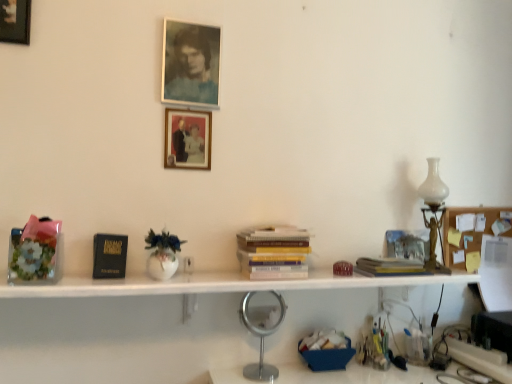
Identify the location of hardcover books at center, the first book in the left-to-right sequence. This screenshot has width=512, height=384. (274, 252).

The width and height of the screenshot is (512, 384). I want to click on white glass table lamp at right, positioned as the 2th table lamp in left-to-right order, so click(434, 212).

Find the location of a particular element. This screenshot has width=512, height=384. hardcover book at center, the first book from the right is located at coordinates (390, 267).

Describe the element at coordinates (390, 267) in the screenshot. I see `hardcover book at center, the first book from the right` at that location.

Describe the element at coordinates (470, 231) in the screenshot. I see `wooden memo board at right` at that location.

Locate an element on the screen. Image resolution: width=512 pixels, height=384 pixels. matte glass photo frame at upper center, which is the 2th picture frame in top-to-bottom order is located at coordinates (190, 63).

Does matte glass photo frame at upper center, which is the 2th picture frame in top-to-bottom order, have a greater height compared to white matte bookshelf at center?

Yes.

Is matte glass photo frame at upper center, arranged as the 1th picture frame when viewed from the right, positioned with its back to white matte bookshelf at center?

matte glass photo frame at upper center, arranged as the 1th picture frame when viewed from the right, does not have its back to white matte bookshelf at center.

Are matte glass photo frame at upper center, which is the 2th picture frame in top-to-bottom order, and white matte bookshelf at center far apart?

No.

From the image's perspective, between matte glass photo frame at upper center, arranged as the 1th picture frame when viewed from the right, and white matte bookshelf at center, which one is located above?

matte glass photo frame at upper center, arranged as the 1th picture frame when viewed from the right, appears higher in the image.

Which table lamp is the 1st one when counting from the right side of the matte wooden picture frame at center, which is the 1th picture frame from back to front? Please provide its 2D coordinates.

[(261, 341)]

Which is less distant, (248, 296) or (191, 126)?

Positioned in front is point (248, 296).

What's the angular difference between silver metallic table lamp at center, the first table lamp from the front, and matte wooden picture frame at center, placed as the 3th picture frame when sorted from top to bottom,'s facing directions?

silver metallic table lamp at center, the first table lamp from the front, and matte wooden picture frame at center, placed as the 3th picture frame when sorted from top to bottom, are facing 0.83 degrees away from each other.

Considering the positions of objects silver metallic table lamp at center, marked as the second table lamp in a back-to-front arrangement, and matte wooden picture frame at center, which is the 1th picture frame from back to front, in the image provided, who is more to the right, silver metallic table lamp at center, marked as the second table lamp in a back-to-front arrangement, or matte wooden picture frame at center, which is the 1th picture frame from back to front,?

silver metallic table lamp at center, marked as the second table lamp in a back-to-front arrangement.

From the picture: How many degrees apart are the facing directions of silver metallic table lamp at center, the 2th table lamp positioned from the right, and wooden memo board at right?

The facing directions of silver metallic table lamp at center, the 2th table lamp positioned from the right, and wooden memo board at right are 0.255 degrees apart.

Is silver metallic table lamp at center, marked as the second table lamp in a back-to-front arrangement, shorter than wooden memo board at right?

Incorrect, the height of silver metallic table lamp at center, marked as the second table lamp in a back-to-front arrangement, does not fall short of that of wooden memo board at right.

Is silver metallic table lamp at center, the first table lamp viewed from the left, situated inside wooden memo board at right or outside?

silver metallic table lamp at center, the first table lamp viewed from the left, cannot be found inside wooden memo board at right.

Is silver metallic table lamp at center, the first table lamp from the front, facing away from wooden memo board at right?

That's not correct — silver metallic table lamp at center, the first table lamp from the front, is not looking away from wooden memo board at right.

Considering the relative sizes of matte glass photo frame at upper center, the third picture frame in the left-to-right sequence, and matte wooden picture frame at center, placed as the 3th picture frame when sorted from top to bottom, in the image provided, is matte glass photo frame at upper center, the third picture frame in the left-to-right sequence, bigger than matte wooden picture frame at center, placed as the 3th picture frame when sorted from top to bottom,?

Yes, matte glass photo frame at upper center, the third picture frame in the left-to-right sequence, is bigger than matte wooden picture frame at center, placed as the 3th picture frame when sorted from top to bottom.

Which of these two, matte glass photo frame at upper center, the third picture frame in the left-to-right sequence, or matte wooden picture frame at center, positioned as the second picture frame in right-to-left order, is wider?

matte glass photo frame at upper center, the third picture frame in the left-to-right sequence.

Consider the image. Is matte glass photo frame at upper center, the second picture frame viewed from the back, further to camera compared to matte wooden picture frame at center, which is counted as the second picture frame, starting from the left?

No, matte glass photo frame at upper center, the second picture frame viewed from the back, is closer to the camera.

Is matte glass photo frame at upper center, arranged as the 2th picture frame when ordered from the bottom, shorter than matte wooden picture frame at center, positioned as the second picture frame in right-to-left order?

No, matte glass photo frame at upper center, arranged as the 2th picture frame when ordered from the bottom, is not shorter than matte wooden picture frame at center, positioned as the second picture frame in right-to-left order.

From a real-world perspective, relative to hardcover book at center, the first book from the right, is wooden picture frame at upper left, which is the third picture frame in back-to-front order, vertically above or below?

wooden picture frame at upper left, which is the third picture frame in back-to-front order, is above hardcover book at center, the first book from the right.

How different are the orientations of wooden picture frame at upper left, which is the third picture frame in back-to-front order, and hardcover book at center, the second book from the left, in degrees?

The facing directions of wooden picture frame at upper left, which is the third picture frame in back-to-front order, and hardcover book at center, the second book from the left, are 0.799 degrees apart.

Choose the correct answer: Is wooden picture frame at upper left, which is the third picture frame from right to left, inside hardcover book at center, the second book from the left, or outside it?

wooden picture frame at upper left, which is the third picture frame from right to left, is spatially situated outside hardcover book at center, the second book from the left.

Is hardcover books at center, which ranks as the 2th book in right-to-left order, located within wooden memo board at right?

No, hardcover books at center, which ranks as the 2th book in right-to-left order, is not surrounded by wooden memo board at right.

Is wooden memo board at right in front of hardcover books at center, which ranks as the 2th book in right-to-left order?

No, wooden memo board at right is further to the viewer.

From a real-world perspective, does wooden memo board at right stand above hardcover books at center, the first book in the left-to-right sequence?

Indeed, from a real-world perspective, wooden memo board at right stands above hardcover books at center, the first book in the left-to-right sequence.

Which is more to the right, wooden memo board at right or hardcover books at center, which ranks as the 2th book in right-to-left order?

Positioned to the right is wooden memo board at right.

I want to click on bookshelf in front of the white glass table lamp at right, marked as the 1th table lamp in a top-to-bottom arrangement, so click(186, 323).

Looking at this image, is white matte bookshelf at center spatially inside white glass table lamp at right, positioned as the 2th table lamp in left-to-right order, or outside of it?

white matte bookshelf at center is located beyond the bounds of white glass table lamp at right, positioned as the 2th table lamp in left-to-right order.

Could you tell me if white matte bookshelf at center is facing white glass table lamp at right, marked as the 1th table lamp in a top-to-bottom arrangement?

No, white matte bookshelf at center does not turn towards white glass table lamp at right, marked as the 1th table lamp in a top-to-bottom arrangement.

The width and height of the screenshot is (512, 384). In order to click on picture frame that is the 2nd object located above the white matte bookshelf at center (from the image's perspective) in this screenshot , I will do `click(190, 63)`.

I want to click on the 2nd picture frame behind the silver metallic table lamp at center, which appears as the 1th table lamp when ordered from the bottom, starting your count from the anchor, so click(x=187, y=139).

Based on their spatial positions, is silver metallic table lamp at center, which ranks as the second table lamp in top-to-bottom order, or matte glass photo frame at upper center, placed as the 2th picture frame when sorted from front to back, further from hardcover book at center, the first book from the right?

matte glass photo frame at upper center, placed as the 2th picture frame when sorted from front to back, is positioned further to the anchor hardcover book at center, the first book from the right.

Based on their spatial positions, is white glass table lamp at right, marked as the 1th table lamp in a top-to-bottom arrangement, or matte glass photo frame at upper center, placed as the 2th picture frame when sorted from front to back, closer to black matte paperback book at left?

matte glass photo frame at upper center, placed as the 2th picture frame when sorted from front to back, is positioned closer to the anchor black matte paperback book at left.

When comparing their distances from white matte bookshelf at center, does silver metallic table lamp at center, marked as the second table lamp in a back-to-front arrangement, or hardcover book at center, the second book from the left, seem further?

hardcover book at center, the second book from the left.

Looking at the image, which one is located closer to silver metallic table lamp at center, which ranks as the second table lamp in top-to-bottom order, matte glass photo frame at upper center, the second picture frame viewed from the back, or wooden picture frame at upper left, arranged as the first picture frame when viewed from the left?

matte glass photo frame at upper center, the second picture frame viewed from the back.

From the image, which object appears to be nearer to white matte bookshelf at center, wooden picture frame at upper left, marked as the 3th picture frame in a bottom-to-top arrangement, or hardcover books at center, which ranks as the 2th book in right-to-left order?

hardcover books at center, which ranks as the 2th book in right-to-left order, is positioned closer to the anchor white matte bookshelf at center.

When comparing their distances from wooden picture frame at upper left, which is the 1th picture frame from front to back, does silver metallic table lamp at center, which appears as the 1th table lamp when ordered from the bottom, or wooden memo board at right seem closer?

silver metallic table lamp at center, which appears as the 1th table lamp when ordered from the bottom, is positioned closer to the anchor wooden picture frame at upper left, which is the 1th picture frame from front to back.

When comparing their distances from black matte paperback book at left, does hardcover book at center, the second book from the left, or white matte bookshelf at center seem closer?

white matte bookshelf at center lies closer to black matte paperback book at left than the other object.

Based on their spatial positions, is matte glass photo frame at upper center, placed as the 2th picture frame when sorted from front to back, or matte wooden picture frame at center, which is counted as the second picture frame, starting from the left, closer to wooden picture frame at upper left, arranged as the first picture frame when viewed from the left?

Among the two, matte glass photo frame at upper center, placed as the 2th picture frame when sorted from front to back, is located nearer to wooden picture frame at upper left, arranged as the first picture frame when viewed from the left.

The width and height of the screenshot is (512, 384). Find the location of `table lamp located between matte wooden picture frame at center, acting as the first picture frame starting from the bottom, and hardcover book at center, the second book from the left, in the left-right direction`. table lamp located between matte wooden picture frame at center, acting as the first picture frame starting from the bottom, and hardcover book at center, the second book from the left, in the left-right direction is located at coordinates (261, 341).

Find the location of a particular element. paperback book between matte wooden picture frame at center, which is counted as the second picture frame, starting from the left, and silver metallic table lamp at center, the first table lamp viewed from the left, in the vertical direction is located at coordinates (109, 256).

Where is `paperback book between wooden picture frame at upper left, which is the 1th picture frame from front to back, and white matte bookshelf at center, in the vertical direction`? paperback book between wooden picture frame at upper left, which is the 1th picture frame from front to back, and white matte bookshelf at center, in the vertical direction is located at coordinates (109, 256).

Where is `book between wooden picture frame at upper left, which is the third picture frame from right to left, and hardcover book at center, the second book from the left`? The image size is (512, 384). book between wooden picture frame at upper left, which is the third picture frame from right to left, and hardcover book at center, the second book from the left is located at coordinates (274, 252).